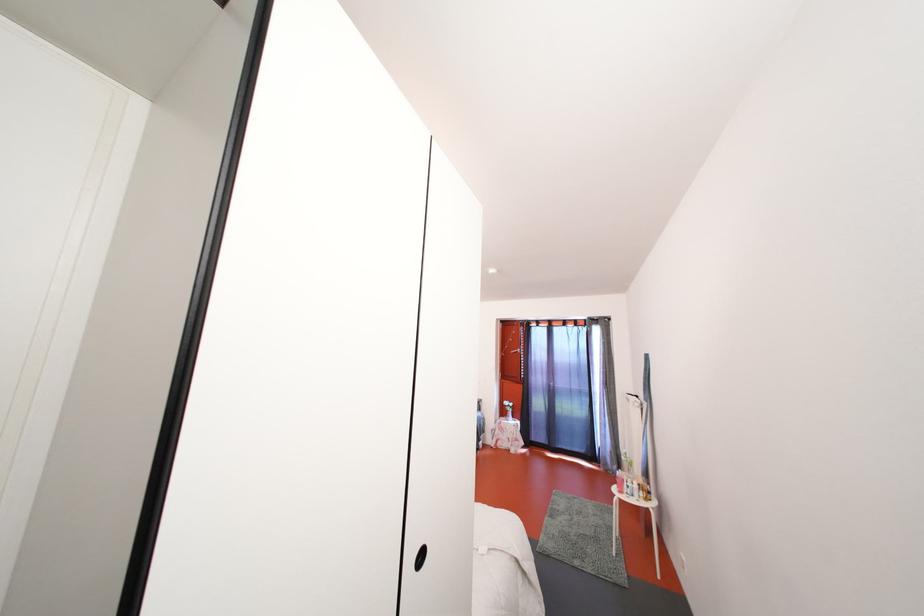
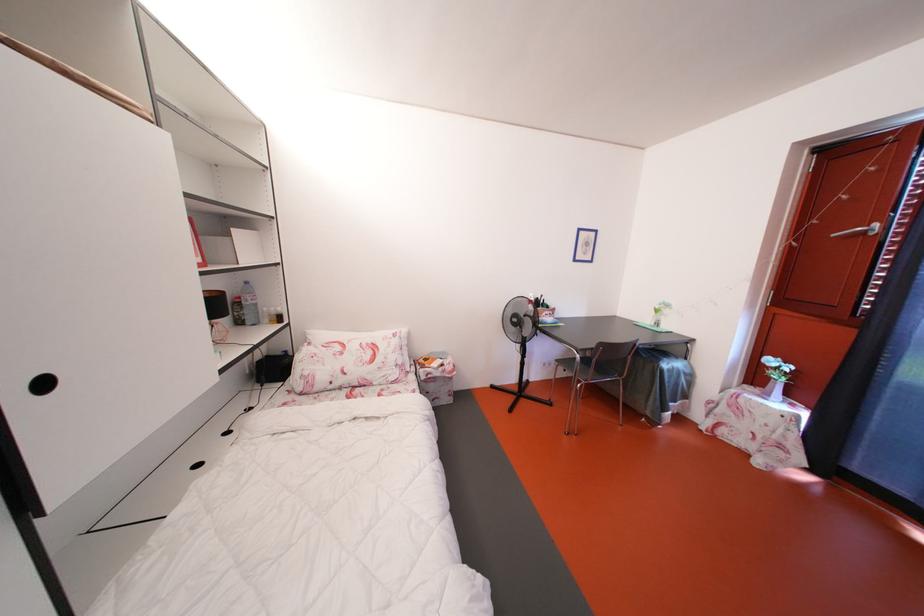
The point at (514, 408) is marked in the first image. Where is the corresponding point in the second image?

(779, 367)